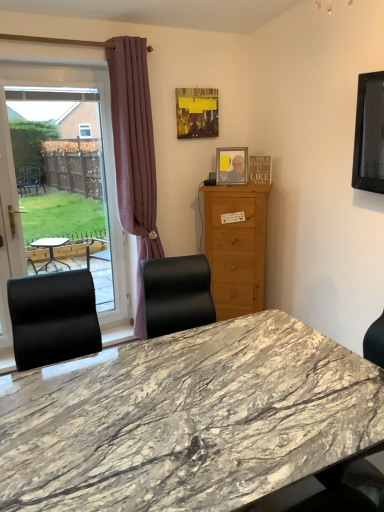
Question: Is light brown wood cabinet at center completely or partially inside matte yellow picture frame at upper center, which is counted as the second picture frame, starting from the right?

Choices:
 (A) yes
 (B) no

Answer: (B)

Question: Considering the relative positions of matte yellow picture frame at upper center, positioned as the 1th picture frame in left-to-right order, and light brown wood cabinet at center in the image provided, is matte yellow picture frame at upper center, positioned as the 1th picture frame in left-to-right order, to the right of light brown wood cabinet at center from the viewer's perspective?

Choices:
 (A) no
 (B) yes

Answer: (A)

Question: Can you confirm if matte yellow picture frame at upper center, which is counted as the second picture frame, starting from the right, is positioned to the left of light brown wood cabinet at center?

Choices:
 (A) no
 (B) yes

Answer: (B)

Question: Is matte yellow picture frame at upper center, the 2th picture frame ordered from the bottom, placed right next to light brown wood cabinet at center?

Choices:
 (A) yes
 (B) no

Answer: (B)

Question: Considering the relative sizes of matte yellow picture frame at upper center, positioned as the 1th picture frame in left-to-right order, and light brown wood cabinet at center in the image provided, is matte yellow picture frame at upper center, positioned as the 1th picture frame in left-to-right order, wider than light brown wood cabinet at center?

Choices:
 (A) no
 (B) yes

Answer: (A)

Question: From a real-world perspective, relative to light brown wood cabinet at center, is marble table at center vertically above or below?

Choices:
 (A) below
 (B) above

Answer: (A)

Question: Is marble table at center bigger or smaller than light brown wood cabinet at center?

Choices:
 (A) small
 (B) big

Answer: (B)

Question: Considering their positions, is marble table at center located in front of or behind light brown wood cabinet at center?

Choices:
 (A) front
 (B) behind

Answer: (A)

Question: Considering the positions of point (243, 366) and point (221, 309), is point (243, 366) closer or farther from the camera than point (221, 309)?

Choices:
 (A) farther
 (B) closer

Answer: (B)

Question: From the image's perspective, is matte white screen door at left above or below light brown wood cabinet at center?

Choices:
 (A) above
 (B) below

Answer: (B)

Question: Relative to light brown wood cabinet at center, is matte white screen door at left in front or behind?

Choices:
 (A) behind
 (B) front

Answer: (B)

Question: Considering the positions of point (3, 151) and point (261, 247), is point (3, 151) closer or farther from the camera than point (261, 247)?

Choices:
 (A) closer
 (B) farther

Answer: (A)

Question: Considering the positions of matte white screen door at left and light brown wood cabinet at center in the image, is matte white screen door at left wider or thinner than light brown wood cabinet at center?

Choices:
 (A) thin
 (B) wide

Answer: (A)

Question: Looking at the image, does matte yellow picture frame at upper center, which is counted as the second picture frame, starting from the right, seem bigger or smaller compared to matte white screen door at left?

Choices:
 (A) big
 (B) small

Answer: (B)

Question: Would you say matte yellow picture frame at upper center, positioned as the 1th picture frame in left-to-right order, is to the left or to the right of matte white screen door at left in the picture?

Choices:
 (A) right
 (B) left

Answer: (A)